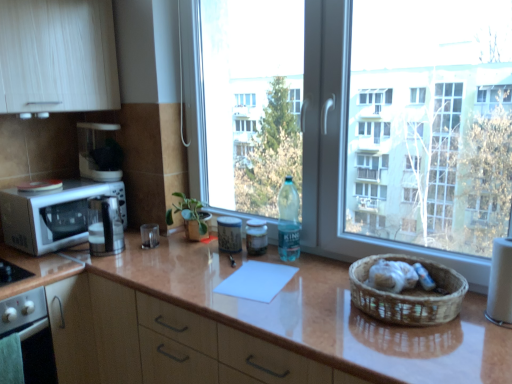
Identify the location of vacant space to the left of white paper towel at right, which ranks as the 1th appliance in bottom-to-top order. The image size is (512, 384). (471, 333).